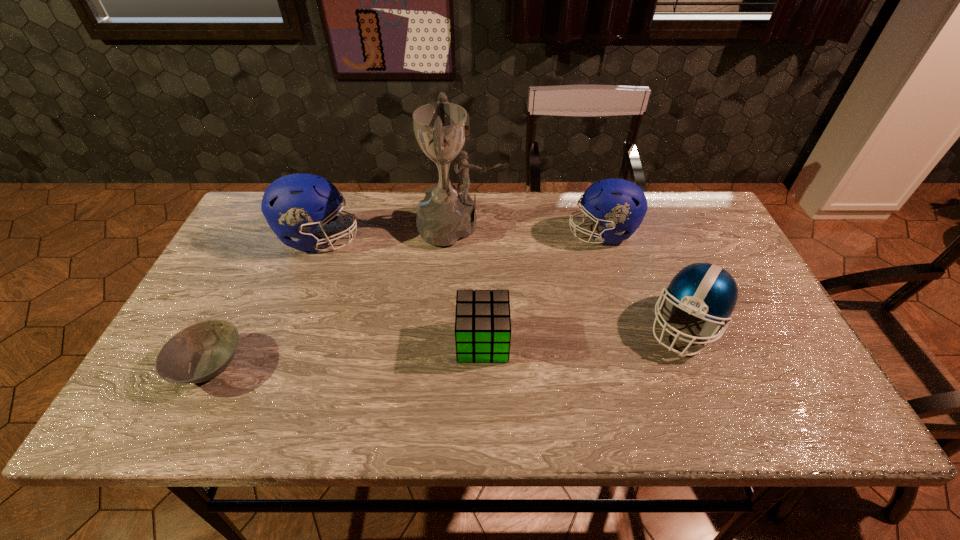
Where is `award situated at the far edge`? award situated at the far edge is located at coordinates (447, 213).

Where is `object that is at the near edge`? Image resolution: width=960 pixels, height=540 pixels. object that is at the near edge is located at coordinates (202, 351).

In order to click on football helmet at the left edge in this screenshot , I will do `click(294, 205)`.

At what (x,y) coordinates should I click in order to perform the action: click on bowl positioned at the left edge. Please return your answer as a coordinate pair (x, y). The width and height of the screenshot is (960, 540). Looking at the image, I should click on (202, 351).

Identify the location of object at the right edge. (705, 290).

Locate an element on the screen. This screenshot has height=540, width=960. object that is at the far left corner is located at coordinates (294, 205).

Locate an element on the screen. The height and width of the screenshot is (540, 960). object that is at the near left corner is located at coordinates (202, 351).

You are a GUI agent. You are given a task and a screenshot of the screen. Output one action in this format:
    pyautogui.click(x=<x>, y=<y>)
    Task: Click on the free point at the far edge
    
    Given the screenshot: What is the action you would take?
    pyautogui.click(x=660, y=228)

Where is `free space at the near edge`? Image resolution: width=960 pixels, height=540 pixels. free space at the near edge is located at coordinates (699, 422).

This screenshot has height=540, width=960. What are the coordinates of `vacant region at the left edge of the desktop` in the screenshot? It's located at (209, 293).